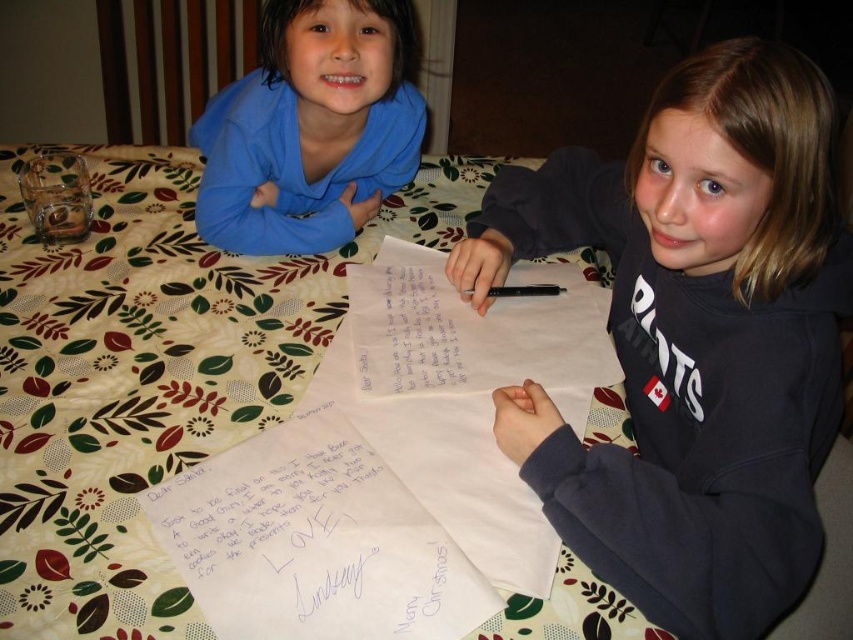
You are a photographer taking a picture of the two children. The white paper at center and the matte blue hoodie at upper left are in your viewfinder. Which object is closer to the camera?

The white paper at center is closer to the camera because it is in front of the matte blue hoodie at upper left.